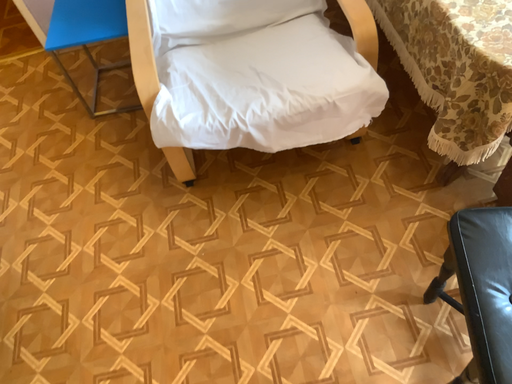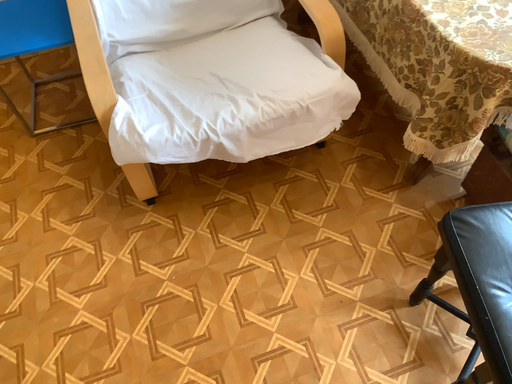
Question: Which way did the camera rotate in the video?

Choices:
 (A) rotated right
 (B) rotated left

Answer: (A)